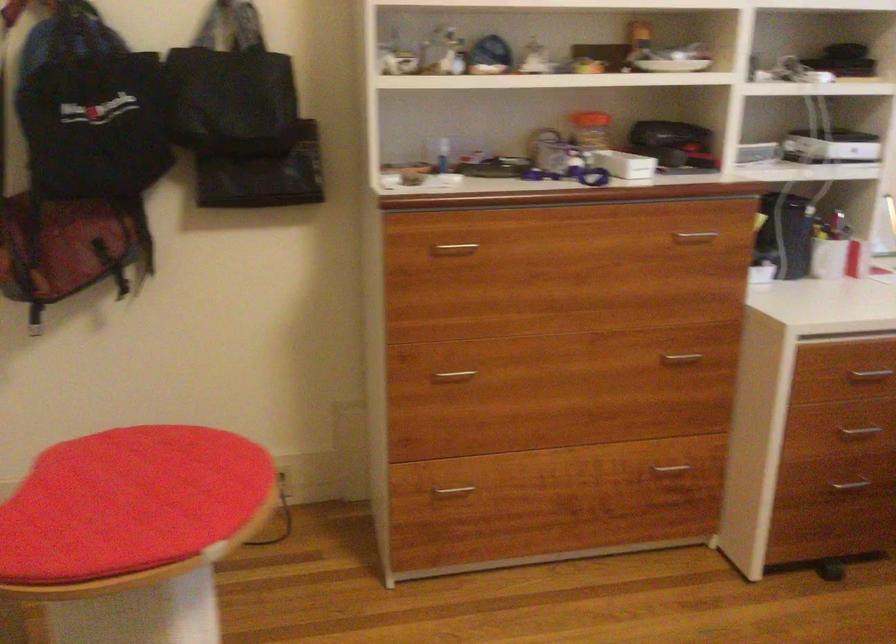
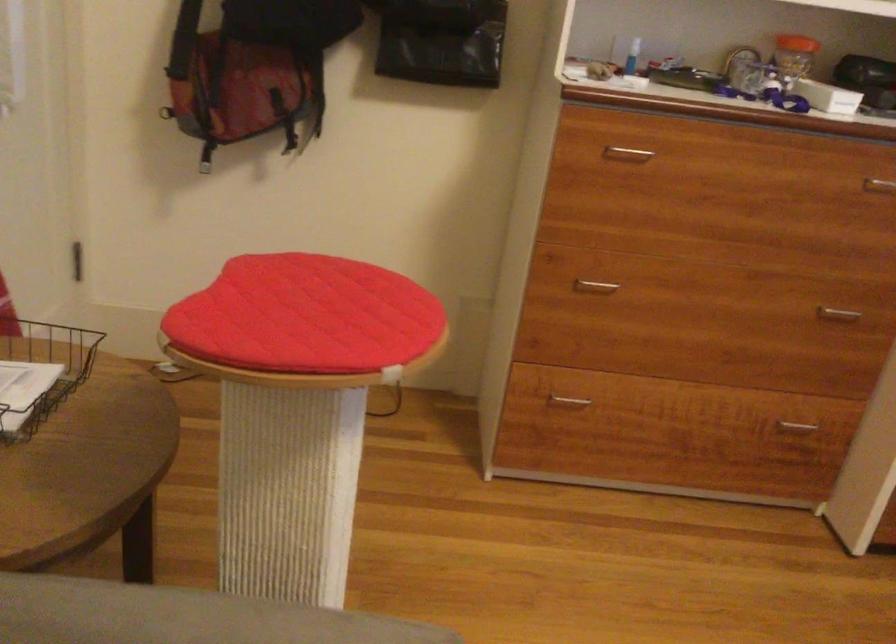
Where in the second image is the point corresponding to pixel 454 377 from the first image?

(595, 286)